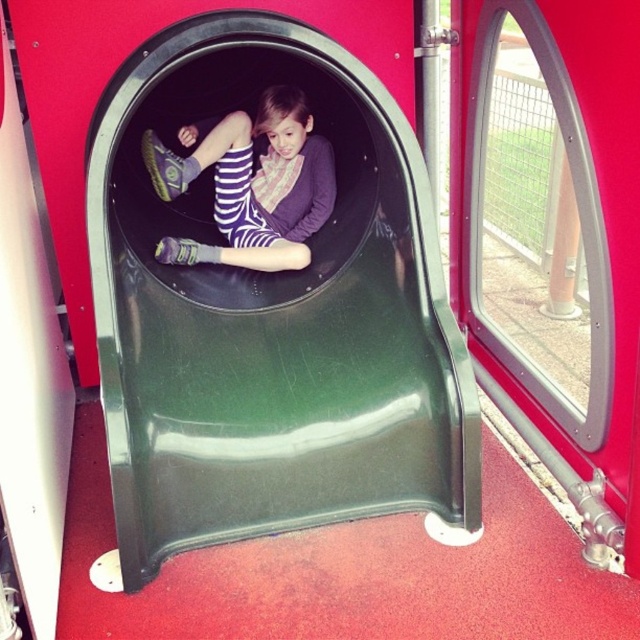
Measure the distance between point (x=396, y=134) and camera.

Point (x=396, y=134) and camera are 2.28 meters apart from each other.

Is green plastic slide at center closer to the viewer compared to striped fabric pants at center?

That is True.

Which is in front, point (449, 532) or point (225, 193)?

Point (449, 532) is more forward.

Identify the location of green plastic slide at center. (272, 320).